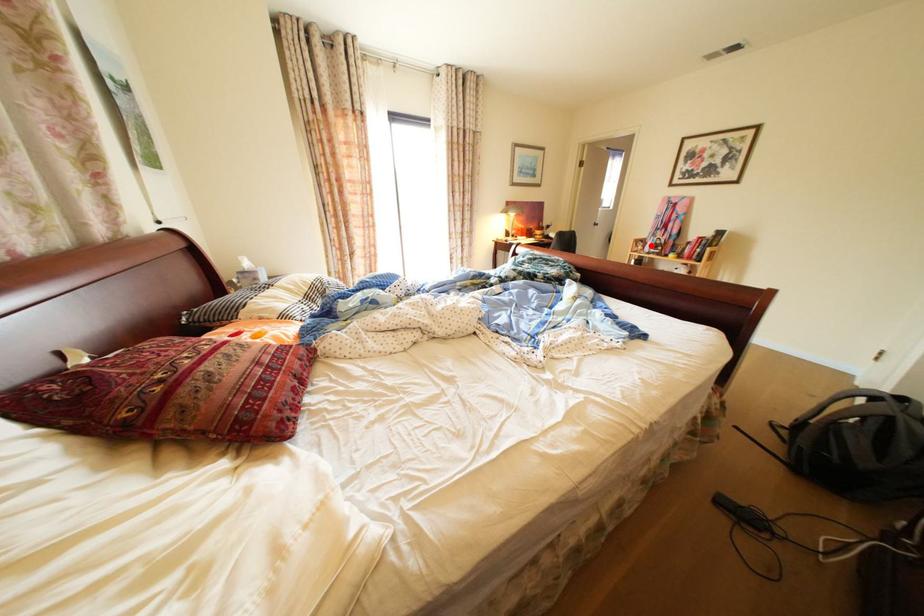
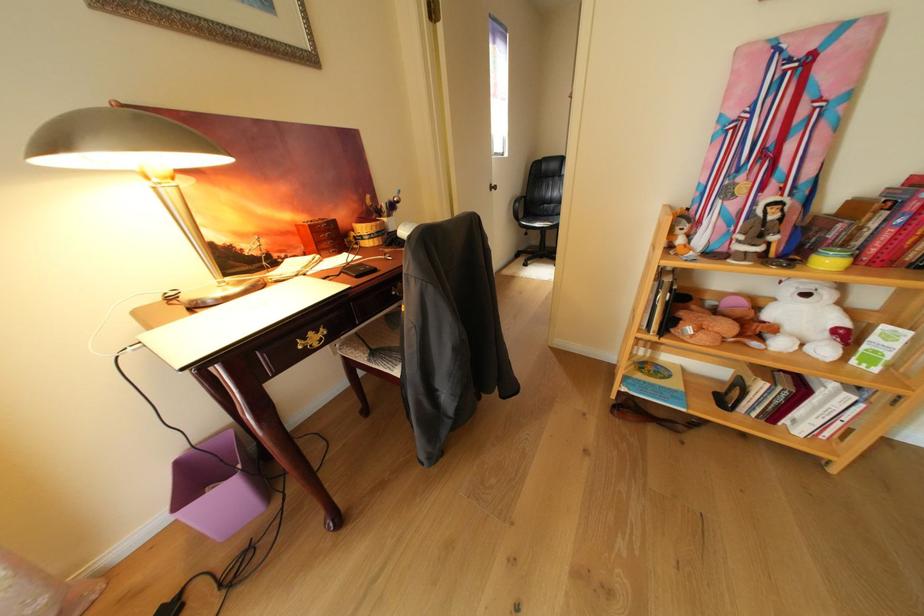
Question: I am providing you with two images of the same scene from different viewpoints. A red point is shown in image1. For the corresponding object point in image2, is it positioned nearer or farther from the camera?

Choices:
 (A) Nearer
 (B) Farther

Answer: (B)